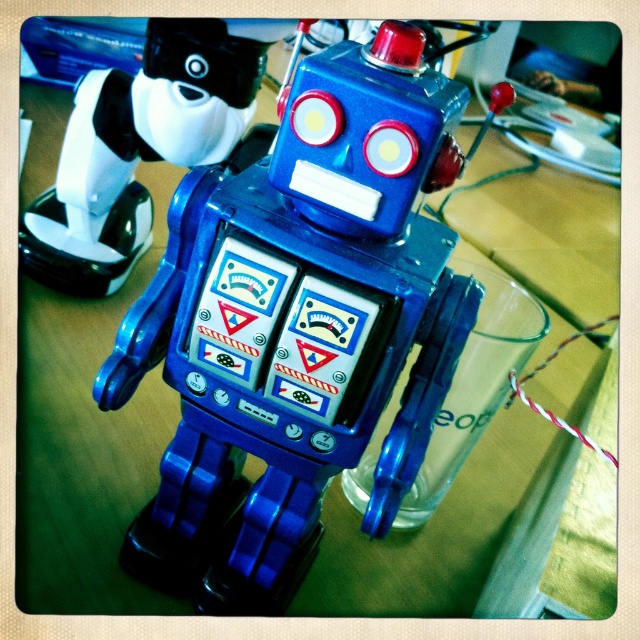
Between metallic blue robot at center and blue plastic robot at center, which one appears on the right side from the viewer's perspective?

metallic blue robot at center is more to the right.

Which is in front, point (400, 481) or point (163, 96)?

Positioned in front is point (400, 481).

Measure the distance between point (x=449, y=326) and camera.

The distance of point (x=449, y=326) from camera is 9.64 inches.

Locate an element on the screen. metallic blue robot at center is located at coordinates (298, 321).